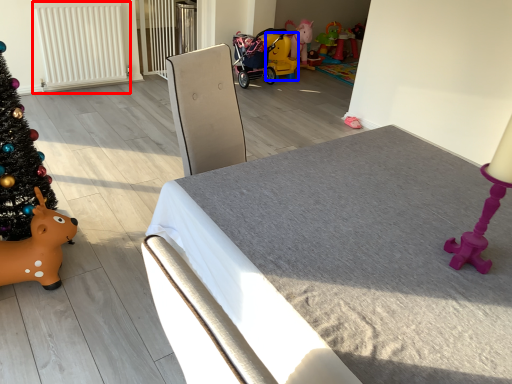
Question: Which of the following is the farthest to the observer, radiator (highlighted by a red box) or toy (highlighted by a blue box)?

Choices:
 (A) radiator
 (B) toy

Answer: (B)